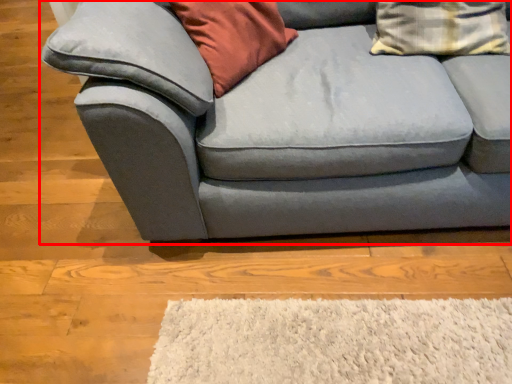
Question: From the image's perspective, where is studio couch (annotated by the red box) located relative to pillow?

Choices:
 (A) above
 (B) below

Answer: (B)